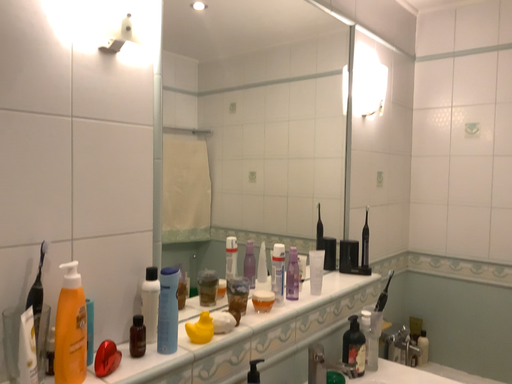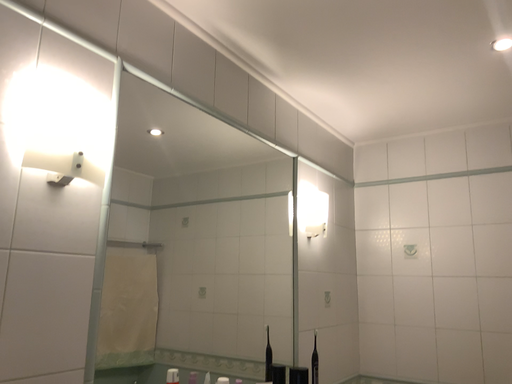
Question: How did the camera likely rotate when shooting the video?

Choices:
 (A) rotated upward
 (B) rotated downward

Answer: (A)